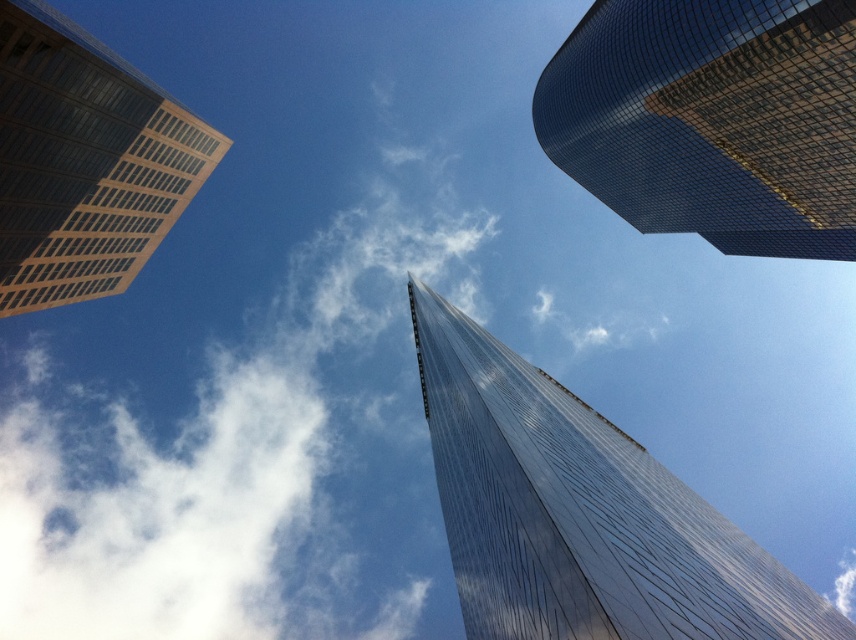
Is white fluffy cloud at upper center positioned at the back of reflective glass skyscraper at center?

That is True.

Between point (192, 520) and point (587, 563), which one is positioned behind?

The point (192, 520) is behind.

The width and height of the screenshot is (856, 640). In order to click on white fluffy cloud at upper center in this screenshot , I will do `click(245, 445)`.

Is point (242, 634) closer to viewer compared to point (40, 122)?

No, it is not.

Which is behind, point (135, 529) or point (4, 164)?

The point (135, 529) is behind.

The width and height of the screenshot is (856, 640). Identify the location of white fluffy cloud at upper center. (245, 445).

Is reflective glass skyscraper at center further to the viewer compared to brown glass skyscraper at upper left?

No, reflective glass skyscraper at center is closer to the viewer.

Locate an element on the screen. This screenshot has width=856, height=640. reflective glass skyscraper at center is located at coordinates (580, 513).

Consider the image. Who is more forward, [508,392] or [1,308]?

Positioned in front is point [508,392].

Locate an element on the screen. reflective glass skyscraper at center is located at coordinates (580, 513).